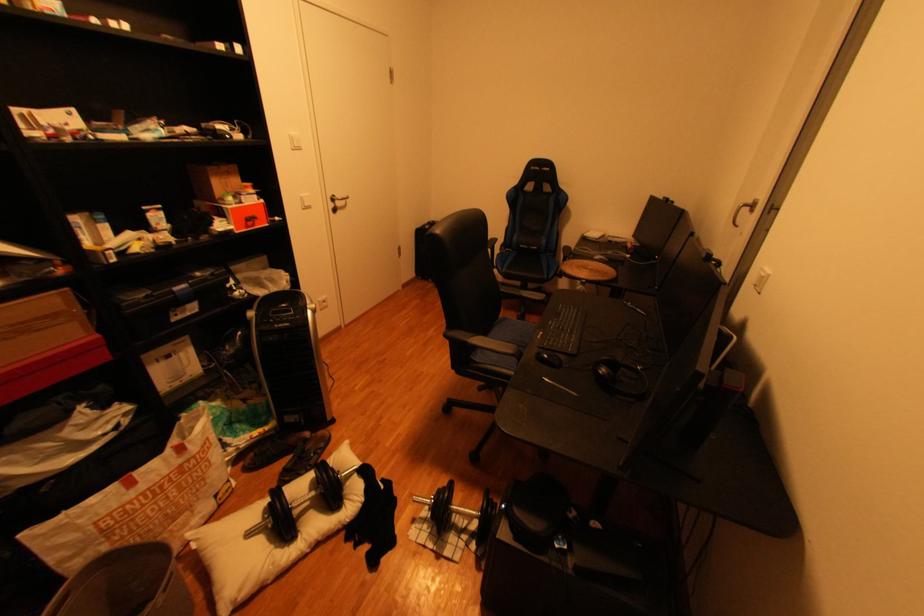
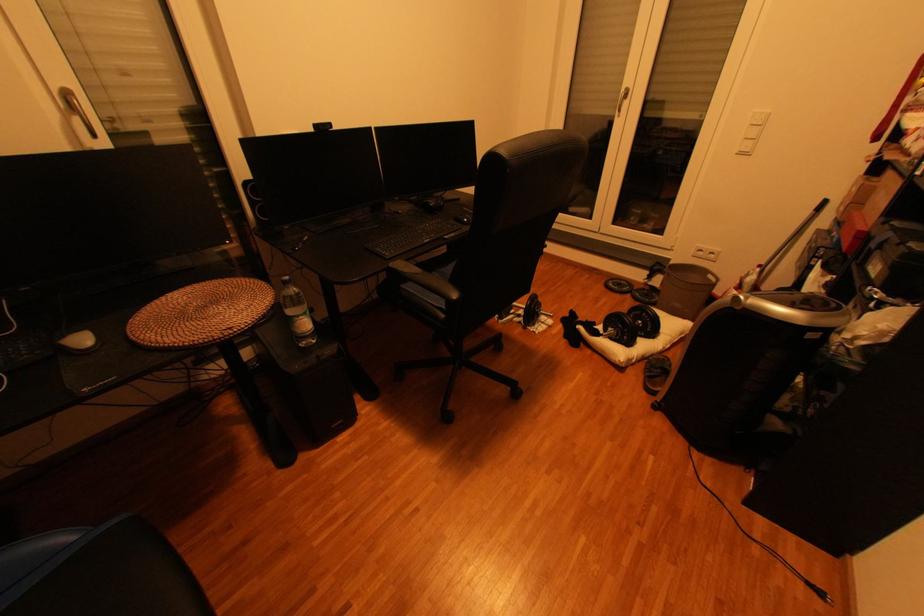
In the second image, find the point that corresponds to pixel 330 448 in the first image.

(658, 373)